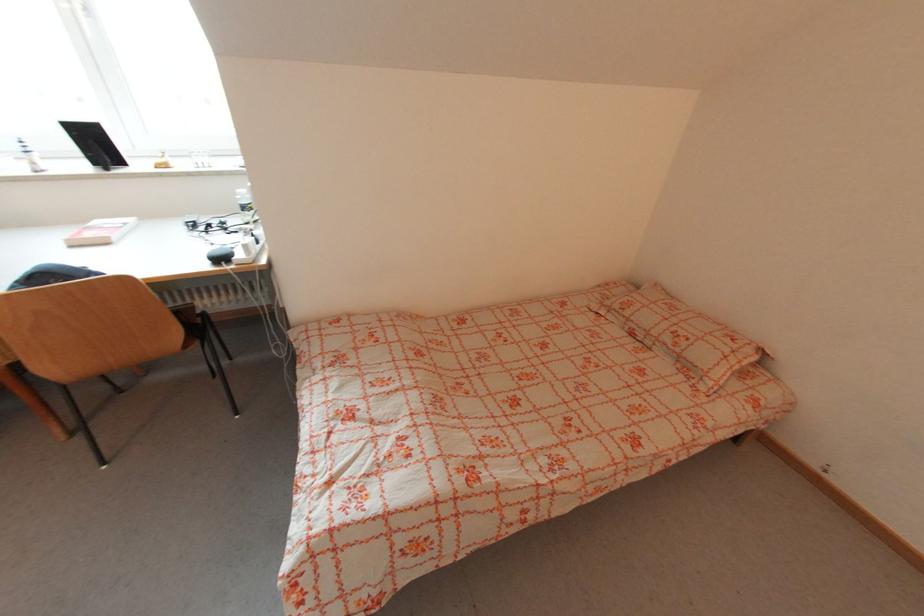
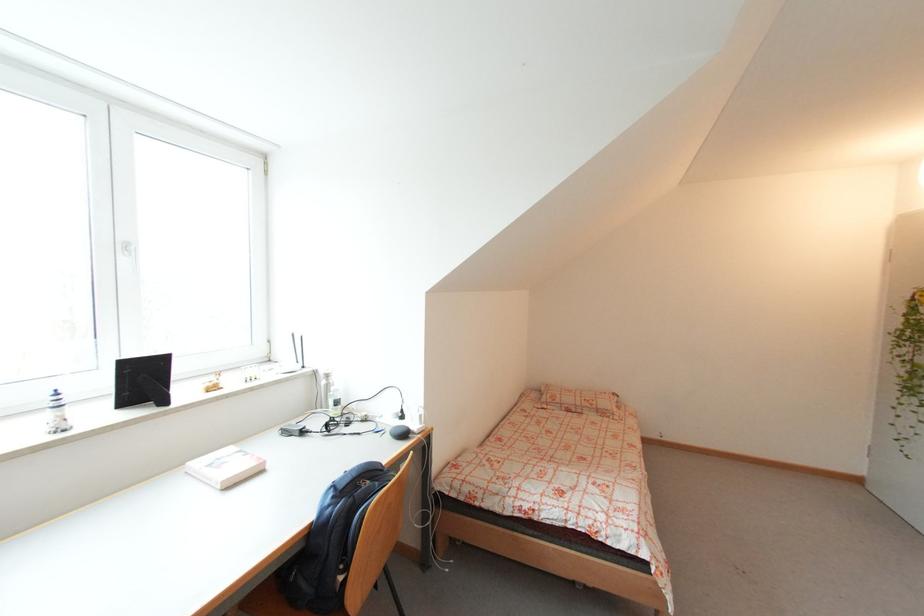
The point at (136,221) is marked in the first image. Where is the corresponding point in the second image?

(236, 450)